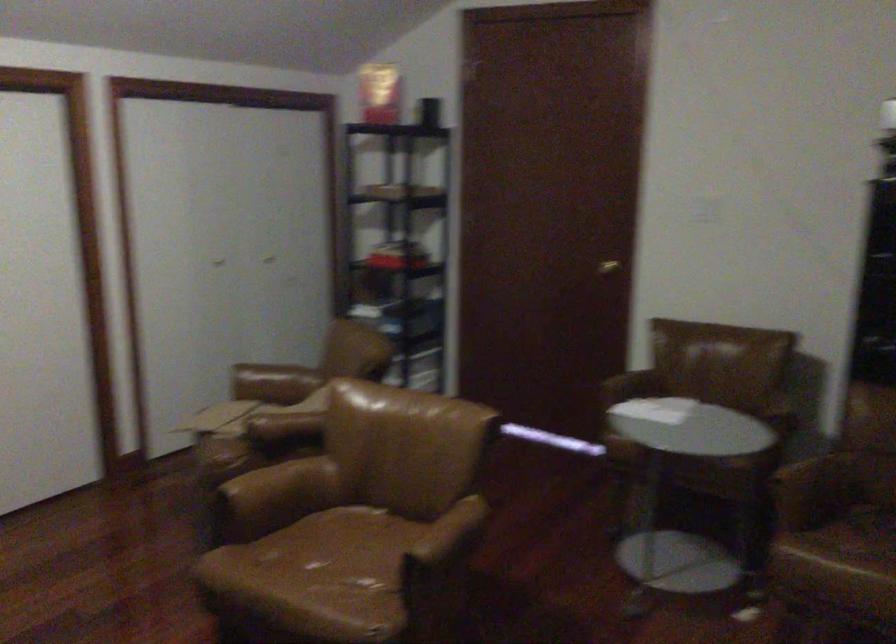
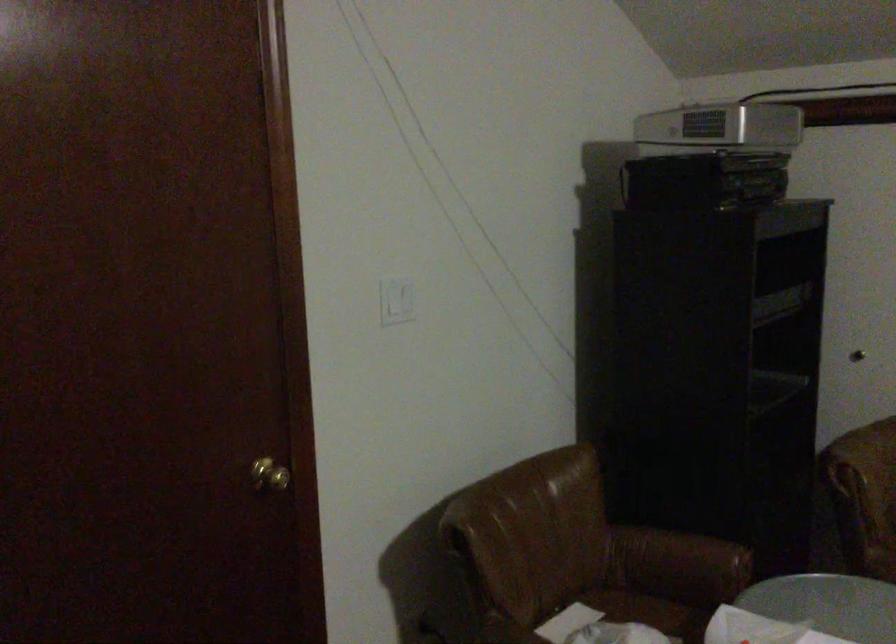
In the second image, find the point that corresponds to pixel 780 406 in the first image.

(679, 559)